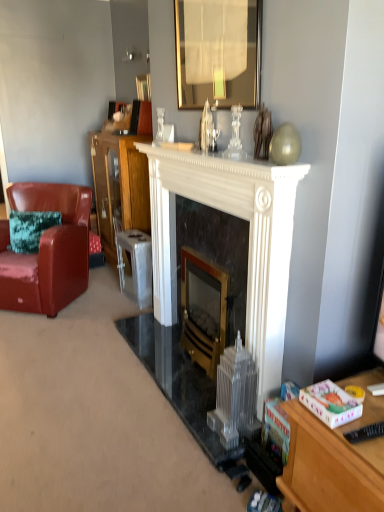
Question: In terms of width, does wooden cabinet at center look wider or thinner when compared to metallic silver stool at center?

Choices:
 (A) thin
 (B) wide

Answer: (B)

Question: Based on their positions, is wooden cabinet at center located to the left or right of metallic silver stool at center?

Choices:
 (A) right
 (B) left

Answer: (B)

Question: Which object is positioned closest to the wooden cabinet at center?

Choices:
 (A) white marble fireplace at center, the 2th fireplace in the right-to-left sequence
 (B) white marble fireplace at center
 (C) gold-framed mirror at upper center
 (D) black plastic remote control at lower right
 (E) glossy ceramic coffee cup at upper center

Answer: (B)

Question: Which of these objects is positioned farthest from the black plastic remote control at lower right?

Choices:
 (A) metallic gold picture frame at upper center
 (B) gold-framed mirror at upper center
 (C) white marble fireplace at center
 (D) wooden cabinet at center
 (E) white marble fireplace at center, acting as the 1th fireplace starting from the left

Answer: (D)